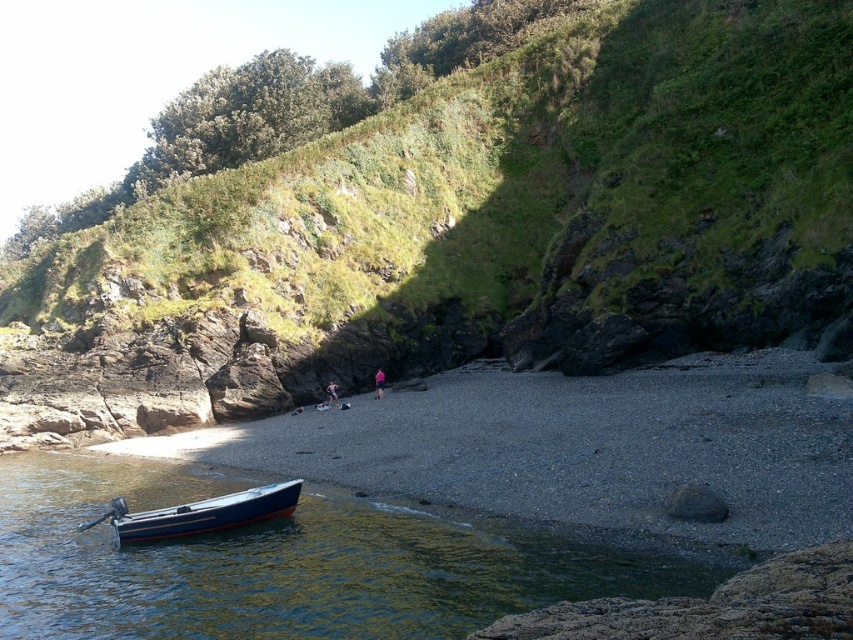
Question: Is blue glossy water at lower left wider than blue polished wood boat at lower left?

Choices:
 (A) yes
 (B) no

Answer: (A)

Question: Which object is positioned closest to the green mossy rock at center?

Choices:
 (A) blue glossy water at lower left
 (B) blue polished wood boat at lower left
 (C) pink fabric at center

Answer: (C)

Question: Does green mossy rock at center appear on the left side of rough textured rock at lower right?

Choices:
 (A) yes
 (B) no

Answer: (A)

Question: Among these points, which one is nearest to the camera?

Choices:
 (A) (335, 397)
 (B) (473, 4)

Answer: (A)

Question: Does rough textured rock at lower right appear over light pink fabric at center?

Choices:
 (A) no
 (B) yes

Answer: (A)

Question: Which point appears farthest from the camera in this image?

Choices:
 (A) (190, 624)
 (B) (772, 586)
 (C) (451, 280)
 (D) (126, 528)

Answer: (C)